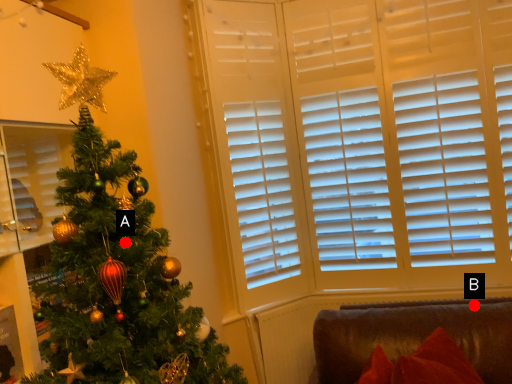
Question: Two points are circled on the image, labeled by A and B beside each circle. Which point appears farthest from the camera in this image?

Choices:
 (A) A is further
 (B) B is further

Answer: (B)